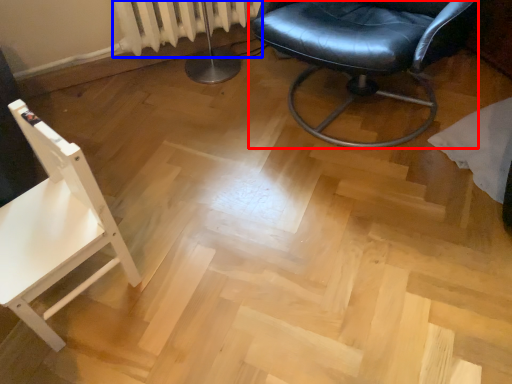
Question: Which object is further to the camera taking this photo, chair (highlighted by a red box) or radiator (highlighted by a blue box)?

Choices:
 (A) chair
 (B) radiator

Answer: (B)